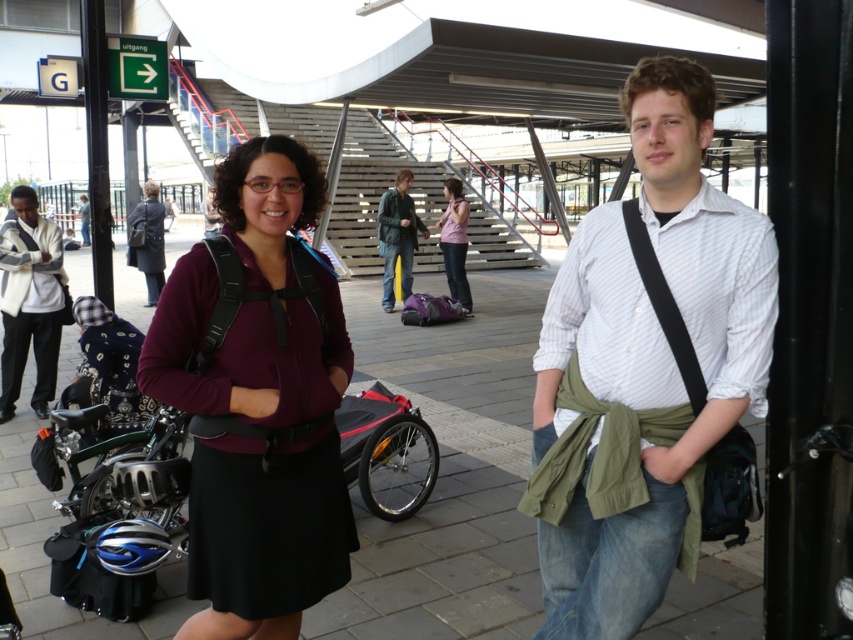
Question: Which object is farther from the camera taking this photo?

Choices:
 (A) matte pink shirt at center
 (B) leather jacket at center

Answer: (B)

Question: Estimate the real-world distances between objects in this image. Which object is farther from the leather jacket at center?

Choices:
 (A) green matte jacket at center
 (B) smooth concrete pavement at center
 (C) matte black backpack at center

Answer: (C)

Question: Can you confirm if smooth concrete pavement at center is smaller than green matte jacket at center?

Choices:
 (A) yes
 (B) no

Answer: (B)

Question: Can you confirm if green matte jacket at center is bigger than matte pink shirt at center?

Choices:
 (A) no
 (B) yes

Answer: (B)

Question: Can you confirm if matte black backpack at center is bigger than leather jacket at center?

Choices:
 (A) yes
 (B) no

Answer: (B)

Question: Which point is farther to the camera?

Choices:
 (A) (405, 260)
 (B) (444, 227)

Answer: (A)